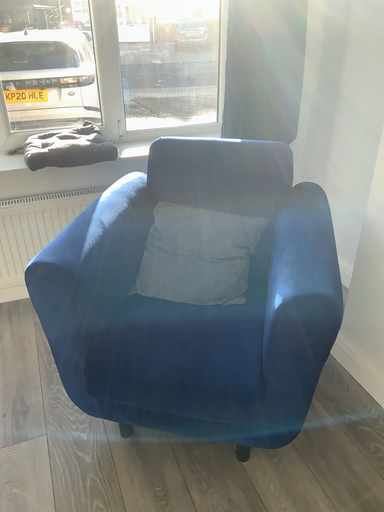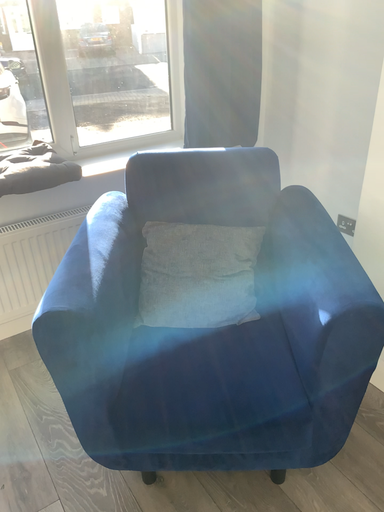
Question: Which way did the camera rotate in the video?

Choices:
 (A) rotated right
 (B) rotated left

Answer: (A)